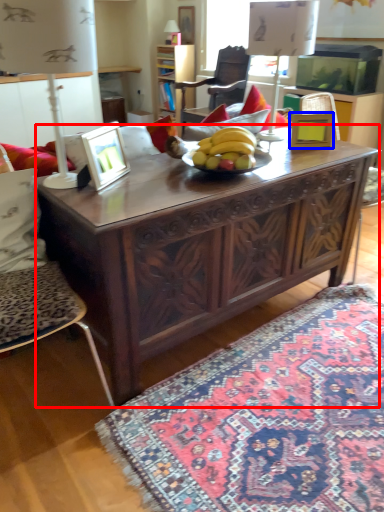
Question: Which point is closer to the camera, table (highlighted by a red box) or picture frame (highlighted by a blue box)?

Choices:
 (A) table
 (B) picture frame

Answer: (A)